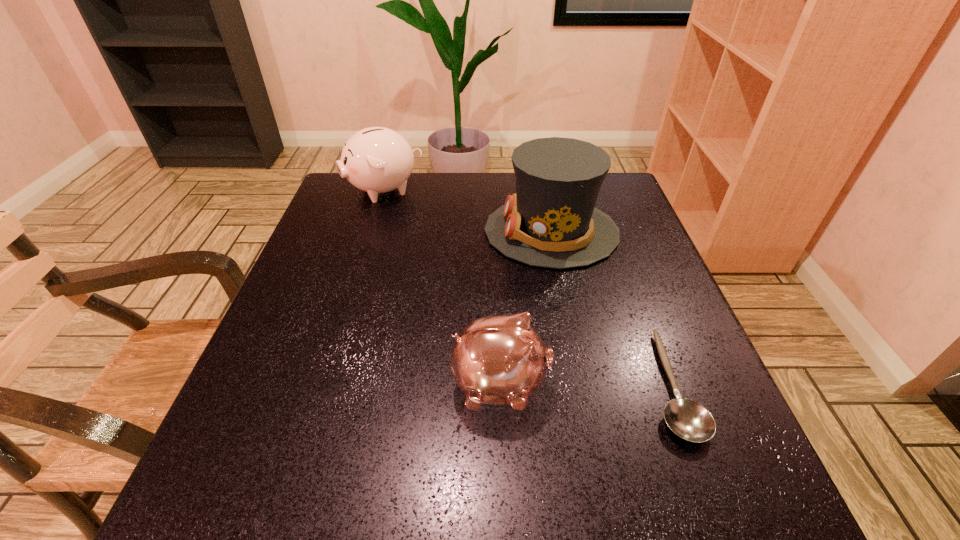
The width and height of the screenshot is (960, 540). Identify the location of free point between the dress hat and the right piggy bank. (526, 308).

Identify the location of vacant space in between the dress hat and the leftmost object. (468, 211).

You are a GUI agent. You are given a task and a screenshot of the screen. Output one action in this format:
    pyautogui.click(x=<x>, y=<y>)
    Task: Click on the vacant space in between the nearer piggy bank and the shortest object
    The width and height of the screenshot is (960, 540).
    Given the screenshot: What is the action you would take?
    pyautogui.click(x=585, y=385)

Locate an element on the screen. The width and height of the screenshot is (960, 540). vacant region between the shorter piggy bank and the leftmost object is located at coordinates (442, 287).

The width and height of the screenshot is (960, 540). I want to click on vacant space that's between the leftmost object and the right piggy bank, so click(x=442, y=287).

Image resolution: width=960 pixels, height=540 pixels. What are the coordinates of `the closest object to the third tallest object` in the screenshot? It's located at (688, 419).

Select which object appears as the second closest to the left piggy bank. Please provide its 2D coordinates. Your answer should be formatted as a tuple, i.e. [(x, y)], where the tuple contains the x and y coordinates of a point satisfying the conditions above.

[(499, 359)]

Where is `free space that satisfies the following two spatial constraints: 1. with goggles on the front of the dress hat; 2. on the right side of the ladle`? This screenshot has width=960, height=540. free space that satisfies the following two spatial constraints: 1. with goggles on the front of the dress hat; 2. on the right side of the ladle is located at coordinates (583, 385).

At what (x,y) coordinates should I click in order to perform the action: click on free point that satisfies the following two spatial constraints: 1. on the back side of the shortest object; 2. with goggles on the front of the dress hat. Please return your answer as a coordinate pair (x, y). The image size is (960, 540). Looking at the image, I should click on (612, 232).

Identify the location of free spot that satisfies the following two spatial constraints: 1. with goggles on the front of the dress hat; 2. on the back side of the shortest object. (583, 385).